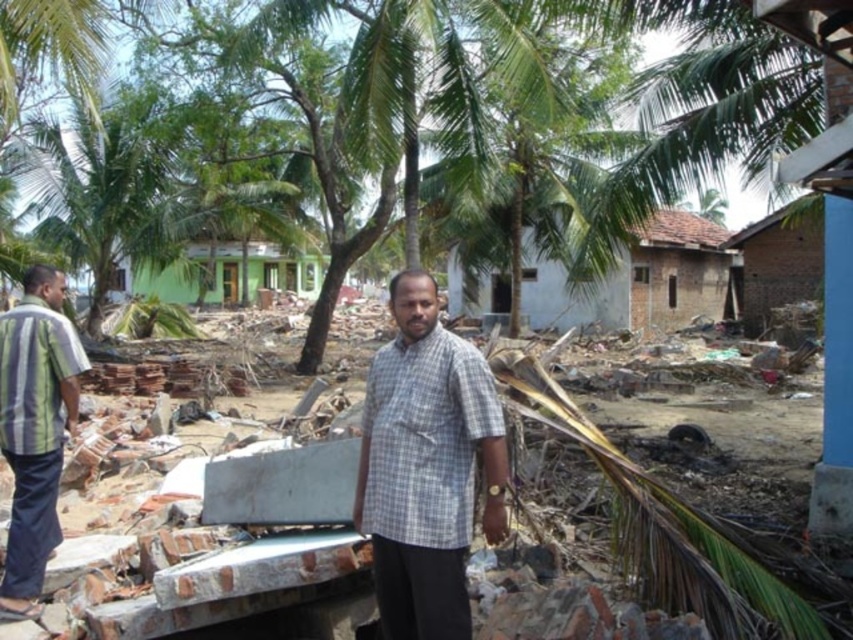
Question: Is gray checkered shirt at center further to camera compared to brown brick hut at upper right?

Choices:
 (A) no
 (B) yes

Answer: (A)

Question: Among these objects, which one is nearest to the camera?

Choices:
 (A) gray checkered shirt at center
 (B) brown brick hut at center right

Answer: (A)

Question: Based on their relative distances, which object is farther from the striped cotton shirt at left?

Choices:
 (A) brown brick hut at center right
 (B) brown brick hut at upper right
 (C) green painted wood house at center
 (D) gray checkered shirt at center

Answer: (C)

Question: Is gray checkered shirt at center closer to the viewer compared to striped cotton shirt at left?

Choices:
 (A) no
 (B) yes

Answer: (B)

Question: From the image, what is the correct spatial relationship of gray checkered shirt at center in relation to brown brick hut at center right?

Choices:
 (A) right
 (B) left

Answer: (B)

Question: Which point is farther to the camera?

Choices:
 (A) brown brick hut at center right
 (B) green painted wood house at center
 (C) gray checkered shirt at center

Answer: (B)